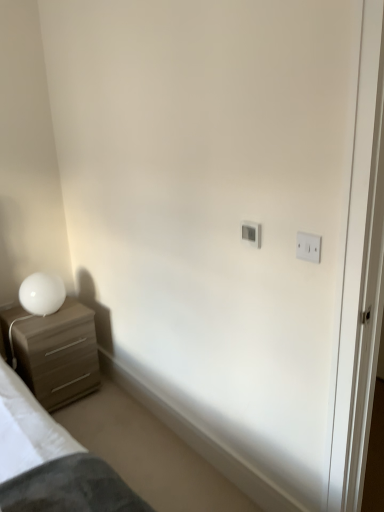
You are a GUI agent. You are given a task and a screenshot of the screen. Output one action in this format:
    pyautogui.click(x=<x>, y=<y>)
    Task: Click on the free space in front of white glossy table lamp at lower left
    
    Given the screenshot: What is the action you would take?
    pyautogui.click(x=36, y=326)